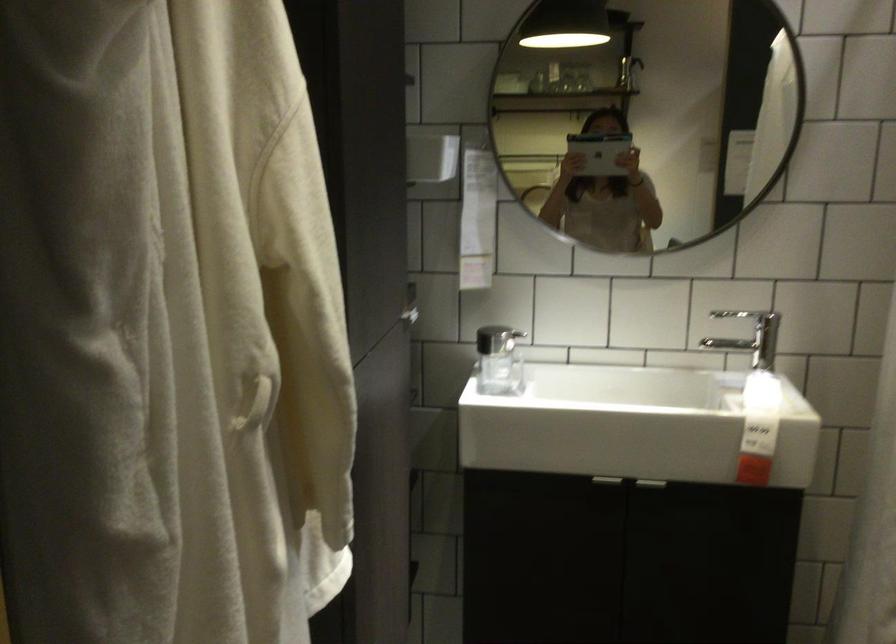
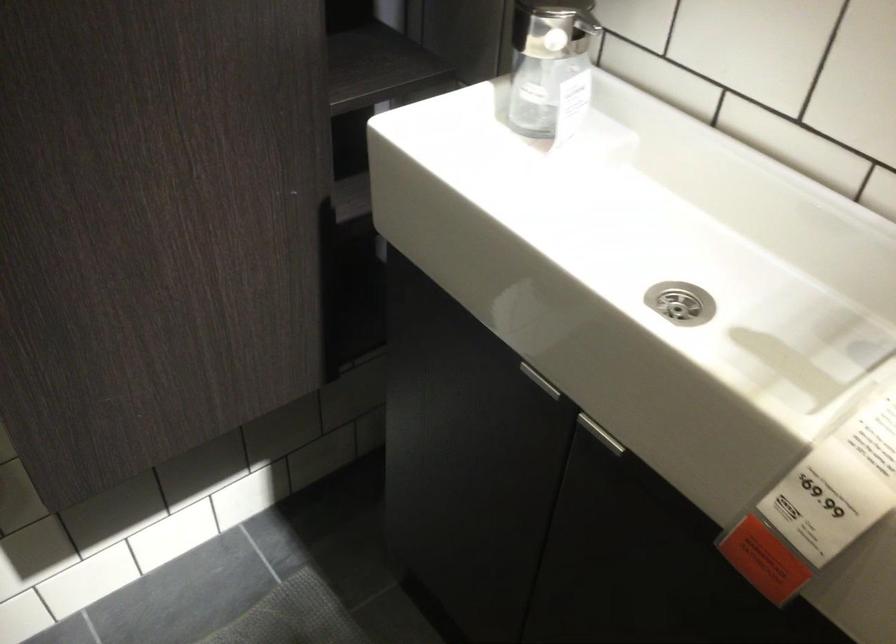
Find the pixel in the second image that matches point 659,487 in the first image.

(599, 433)